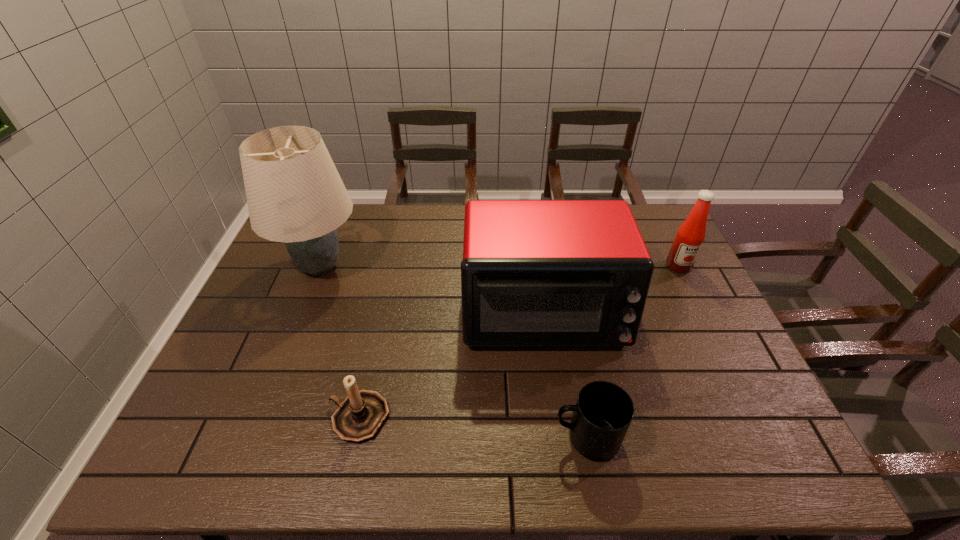
In the image, there is a desktop. Identify the location of vacant area at the left edge. The image size is (960, 540). (249, 406).

In order to click on free space at the right edge in this screenshot , I will do `click(712, 424)`.

Identify the location of free space at the near left corner of the desktop. The height and width of the screenshot is (540, 960). (231, 467).

Identify the location of vacant space at the far right corner of the desktop. Image resolution: width=960 pixels, height=540 pixels. (657, 226).

This screenshot has width=960, height=540. What are the coordinates of `vacant point at the near right corner` in the screenshot? It's located at (771, 441).

Locate an element on the screen. free space that is in between the fourth object from right to left and the shortest object is located at coordinates (472, 428).

In order to click on vacant area between the rightmost object and the mug in this screenshot , I will do `click(633, 352)`.

Locate an element on the screen. vacant area between the shortest object and the lampshade is located at coordinates (453, 352).

Locate an element on the screen. This screenshot has height=540, width=960. unoccupied position between the toaster oven and the candle holder is located at coordinates (451, 365).

Locate an element on the screen. The image size is (960, 540). free space between the shortest object and the toaster oven is located at coordinates (564, 375).